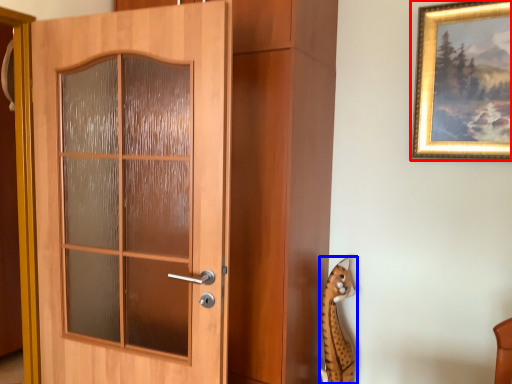
Question: Which point is closer to the camera, picture frame (highlighted by a red box) or animal (highlighted by a blue box)?

Choices:
 (A) picture frame
 (B) animal

Answer: (A)